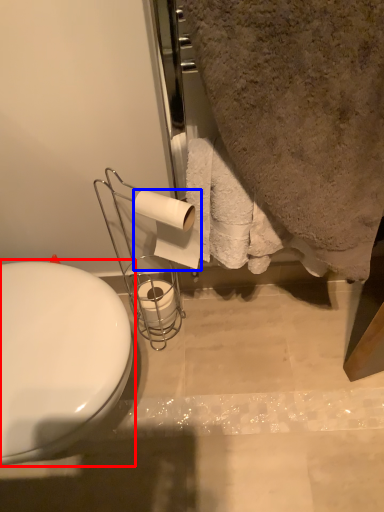
Question: Among these objects, which one is nearest to the camera, toilet (highlighted by a red box) or toilet paper (highlighted by a blue box)?

Choices:
 (A) toilet
 (B) toilet paper

Answer: (A)